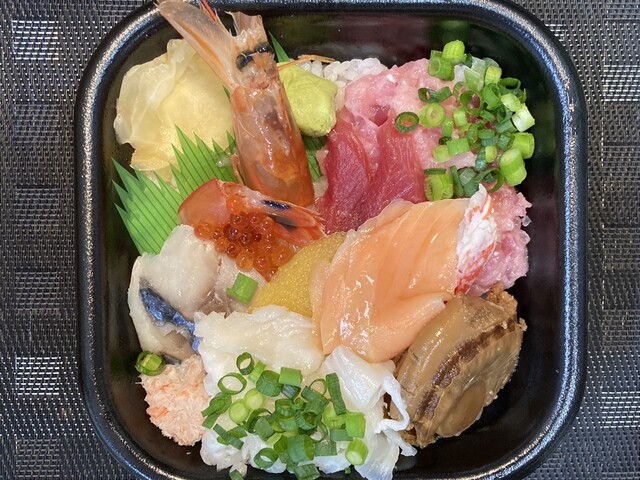
This screenshot has height=480, width=640. I want to click on blue tablecloth or similar linen, so click(x=49, y=193).